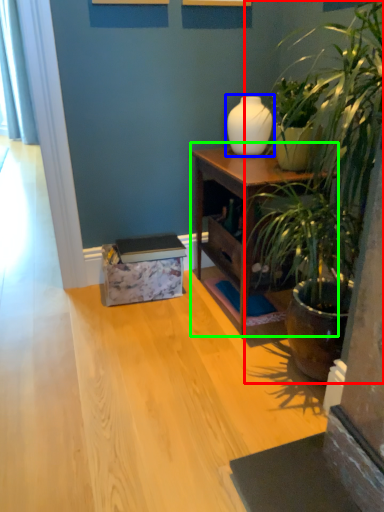
Question: Considering the real-world distances, which object is farthest from houseplant (highlighted by a red box)? vase (highlighted by a blue box) or nightstand (highlighted by a green box)?

Choices:
 (A) vase
 (B) nightstand

Answer: (A)